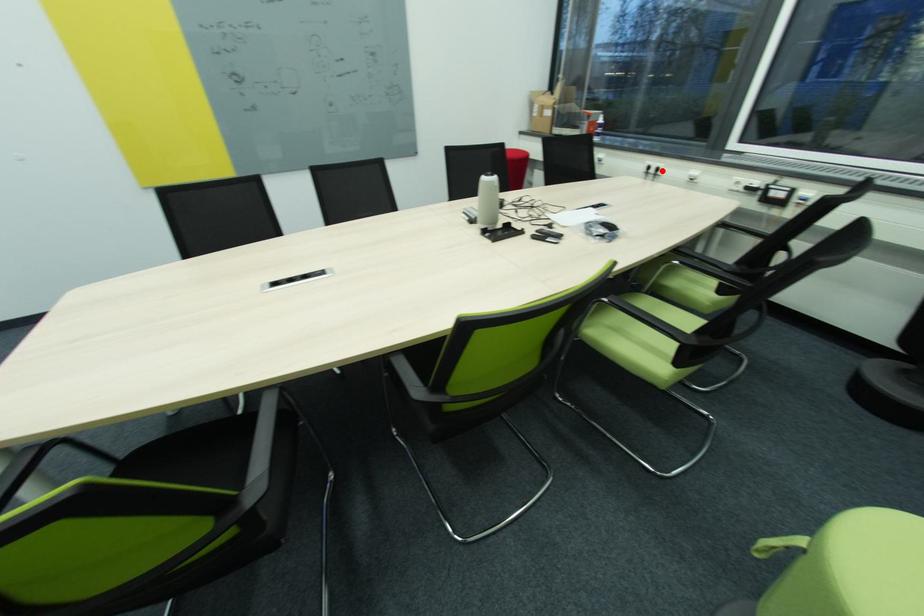
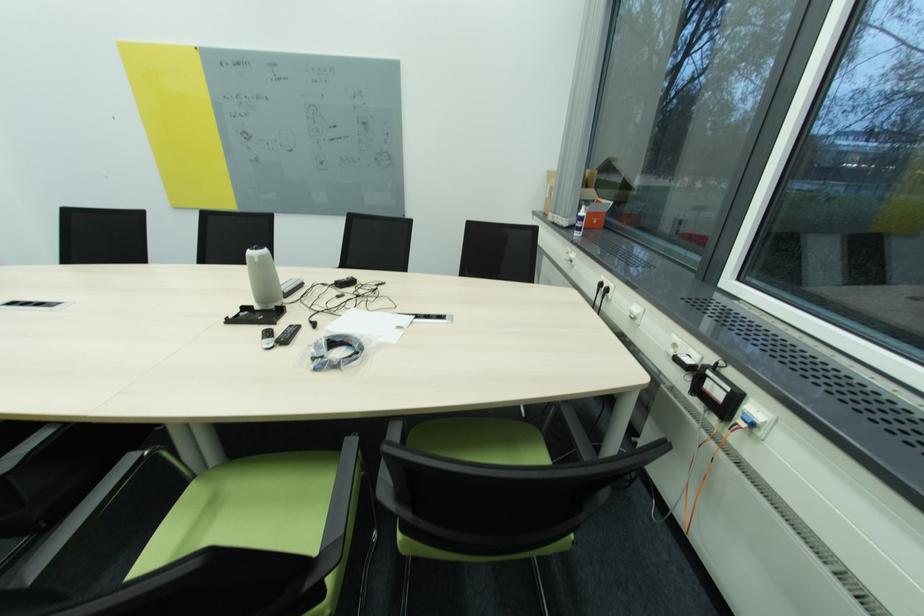
The point at the highlighted location is marked in the first image. Where is the corresponding point in the second image?

(612, 291)